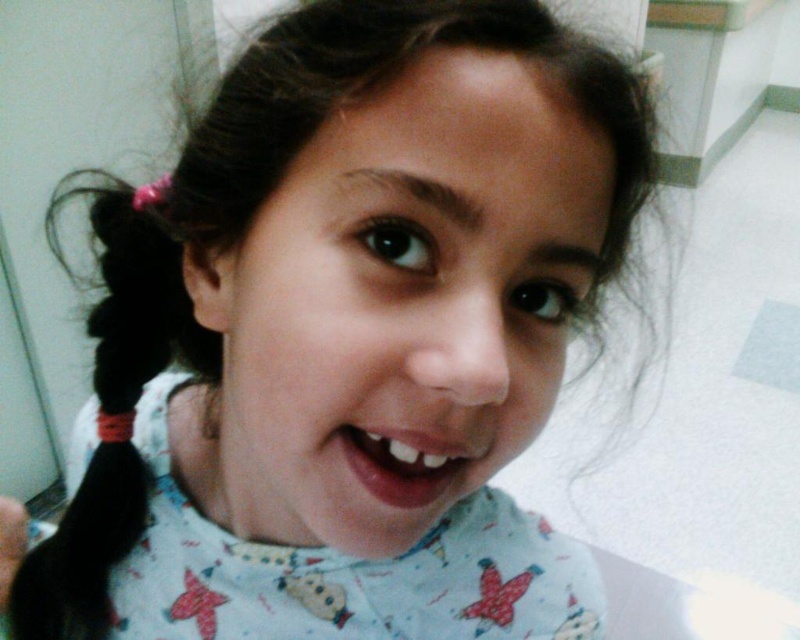
Looking at this image, between smooth skin face at center and black silky hair at left, which one appears on the right side from the viewer's perspective?

Positioned to the right is smooth skin face at center.

The width and height of the screenshot is (800, 640). I want to click on smooth skin face at center, so click(404, 301).

Which of these two, black silky hair at left or smooth skin mouth at center, stands shorter?

smooth skin mouth at center

Does black silky hair at left have a greater height compared to smooth skin mouth at center?

Yes, black silky hair at left is taller than smooth skin mouth at center.

Is point (76, 637) positioned before point (436, 460)?

No, (76, 637) is behind (436, 460).

This screenshot has width=800, height=640. Find the location of `black silky hair at left`. black silky hair at left is located at coordinates (108, 413).

Which is behind, point (442, 76) or point (434, 490)?

The point (434, 490) is more distant.

Which is more to the left, smooth skin face at center or smooth skin mouth at center?

Positioned to the left is smooth skin face at center.

Between point (432, 312) and point (412, 483), which one is positioned behind?

The point (412, 483) is more distant.

Where is `smooth skin face at center`? Image resolution: width=800 pixels, height=640 pixels. smooth skin face at center is located at coordinates (404, 301).